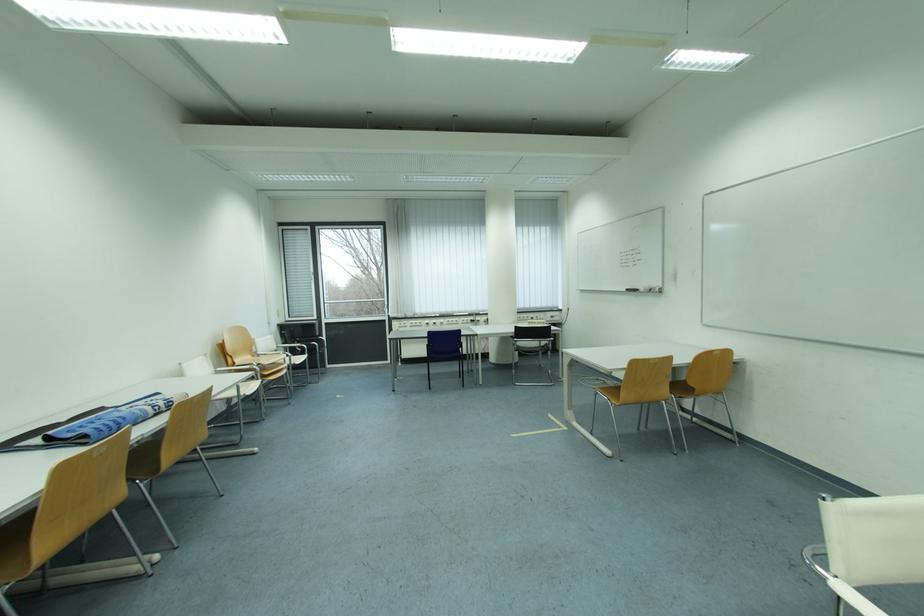
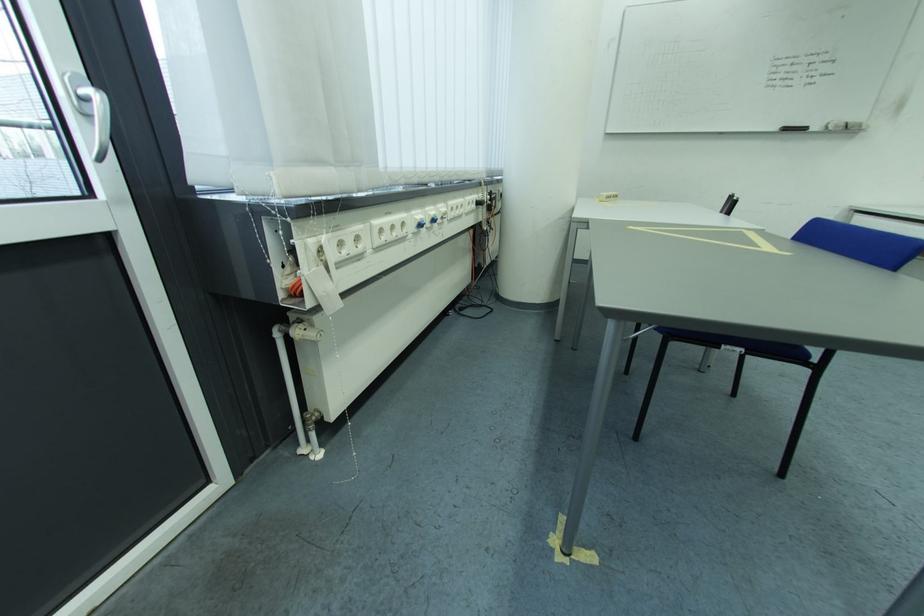
The point at (637, 293) is marked in the first image. Where is the corresponding point in the second image?

(796, 131)